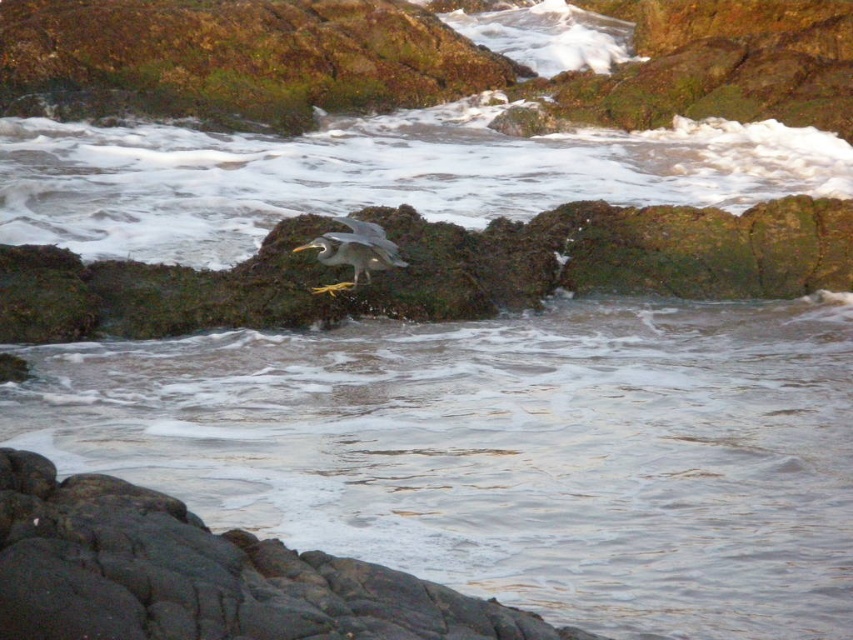
Question: Does smooth gray rock at lower center have a smaller size compared to gray matte bird at center?

Choices:
 (A) yes
 (B) no

Answer: (B)

Question: Can you confirm if smooth gray rock at lower center is positioned below gray matte bird at center?

Choices:
 (A) yes
 (B) no

Answer: (A)

Question: Can you confirm if smooth gray rock at lower center is wider than gray matte bird at center?

Choices:
 (A) no
 (B) yes

Answer: (B)

Question: Which point is closer to the camera taking this photo?

Choices:
 (A) (335, 566)
 (B) (334, 218)

Answer: (A)

Question: Which point is farther from the camera taking this photo?

Choices:
 (A) (345, 284)
 (B) (248, 582)

Answer: (A)

Question: Which of the following is the closest to the observer?

Choices:
 (A) smooth gray rock at lower center
 (B) gray matte bird at center

Answer: (A)